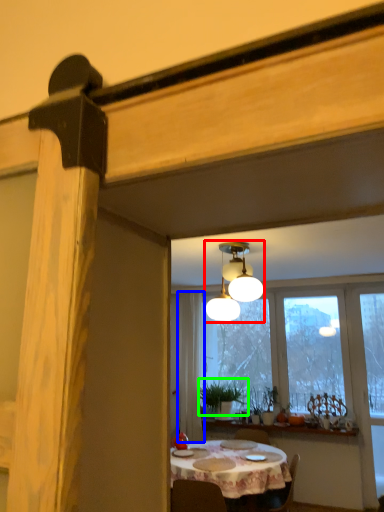
Question: Considering the real-world distances, which object is farthest from lamp (highlighted by a red box)? curtain (highlighted by a blue box) or plant (highlighted by a green box)?

Choices:
 (A) curtain
 (B) plant

Answer: (B)